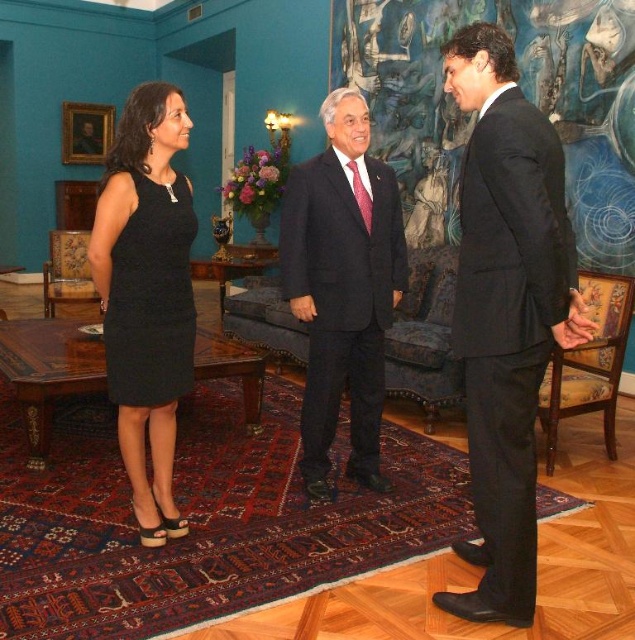
You are a guest at a formal event and need to choose between the black suit at right and the black matte suit at center to match your outfit. Based on their positions in the image, which one is closer to you?

The black suit at right is closer to you because it is in front of the black matte suit at center.